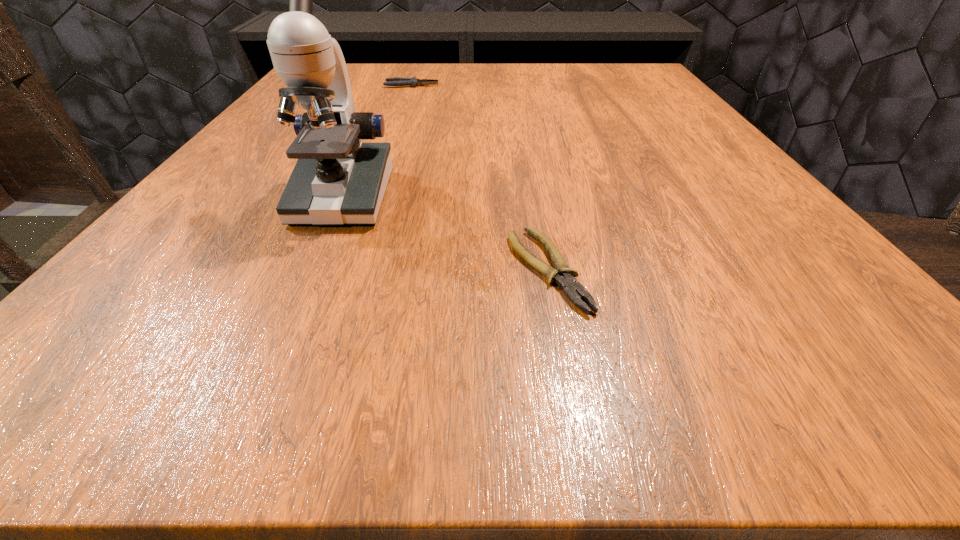
The width and height of the screenshot is (960, 540). I want to click on object located in the left edge section of the desktop, so click(337, 180).

Find the location of `free space at the far edge of the desktop`. free space at the far edge of the desktop is located at coordinates (447, 74).

The width and height of the screenshot is (960, 540). In the image, there is a desktop. In order to click on vacant space at the near edge in this screenshot , I will do `click(402, 363)`.

In the image, there is a desktop. Identify the location of vacant area at the left edge. This screenshot has width=960, height=540. (262, 227).

Locate an element on the screen. free space at the right edge of the desktop is located at coordinates tap(708, 280).

Locate an element on the screen. free space at the far left corner is located at coordinates (371, 80).

The height and width of the screenshot is (540, 960). In order to click on vacant region at the near right corner of the desktop in this screenshot , I will do `click(892, 336)`.

Identify the location of vacant space that's between the nearer pliers and the second tallest object. The height and width of the screenshot is (540, 960). (479, 177).

The width and height of the screenshot is (960, 540). Find the location of `empty space that is in between the shortest object and the microscope`. empty space that is in between the shortest object and the microscope is located at coordinates (444, 233).

This screenshot has width=960, height=540. What are the coordinates of `empty space between the second nearest object and the farther pliers` in the screenshot? It's located at (377, 141).